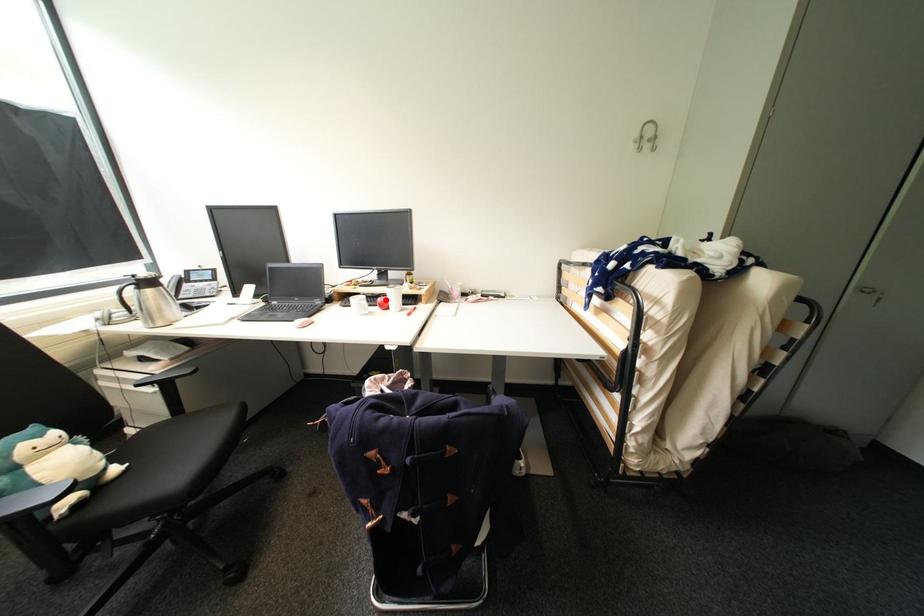
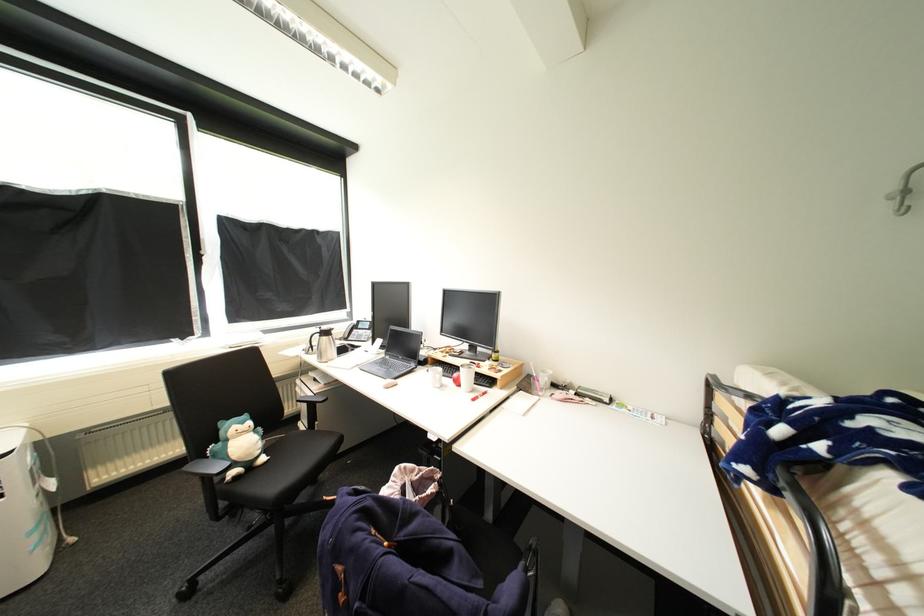
The point at the highlighted location is marked in the first image. Where is the corresponding point in the second image?

(462, 376)